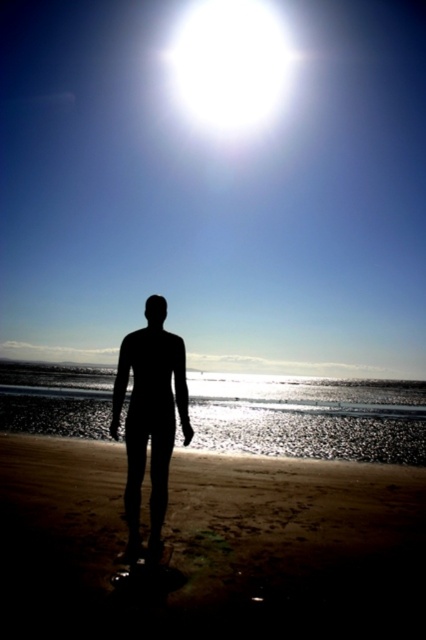
Locate an element on the screen. black matte figure at center is located at coordinates (149, 419).

Does black matte figure at center have a lesser height compared to transparent plastic surfboard at lower center?

No, black matte figure at center is not shorter than transparent plastic surfboard at lower center.

What are the coordinates of `black matte figure at center` in the screenshot? It's located at (149, 419).

From the picture: Between brown sandy beach at lower center and transparent plastic surfboard at lower center, which one is positioned lower?

Positioned lower is brown sandy beach at lower center.

Who is more distant from viewer, (51, 444) or (132, 584)?

Positioned behind is point (51, 444).

I want to click on brown sandy beach at lower center, so click(x=212, y=547).

Looking at this image, is brown sandy beach at lower center shorter than black matte figure at center?

Yes, brown sandy beach at lower center is shorter than black matte figure at center.

Can you confirm if brown sandy beach at lower center is thinner than black matte figure at center?

No.

Who is more forward, (330, 520) or (192, 428)?

Point (330, 520) is in front.

You are a GUI agent. You are given a task and a screenshot of the screen. Output one action in this format:
    pyautogui.click(x=<x>, y=<y>)
    Task: Click on the brown sandy beach at lower center
    The image size is (426, 640).
    Given the screenshot: What is the action you would take?
    pyautogui.click(x=212, y=547)